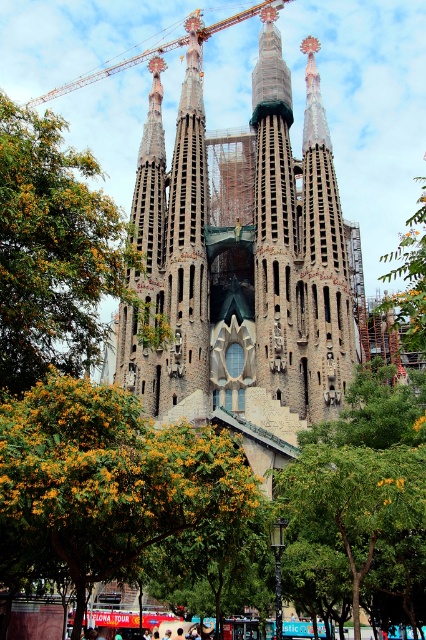
Question: Is brown stone church at center further to the viewer compared to green leafy tree at center?

Choices:
 (A) yes
 (B) no

Answer: (A)

Question: Which point is farther from the camera taking this photo?

Choices:
 (A) (134, 58)
 (B) (397, 518)
 (C) (406, 301)

Answer: (A)

Question: Is green leafy tree at left closer to camera compared to metallic construction crane at upper left?

Choices:
 (A) yes
 (B) no

Answer: (A)

Question: Does brown stone church at center have a lesser width compared to green leafy tree at upper right?

Choices:
 (A) yes
 (B) no

Answer: (A)

Question: Which of the following is the farthest from the observer?

Choices:
 (A) green leafy tree at upper right
 (B) green leafy tree at left
 (C) green leafy tree at center
 (D) yellow-green leaves at center

Answer: (A)

Question: Which object appears farthest from the camera in this image?

Choices:
 (A) brown stone church at center
 (B) metallic construction crane at upper left
 (C) yellow-green leaves at center

Answer: (B)